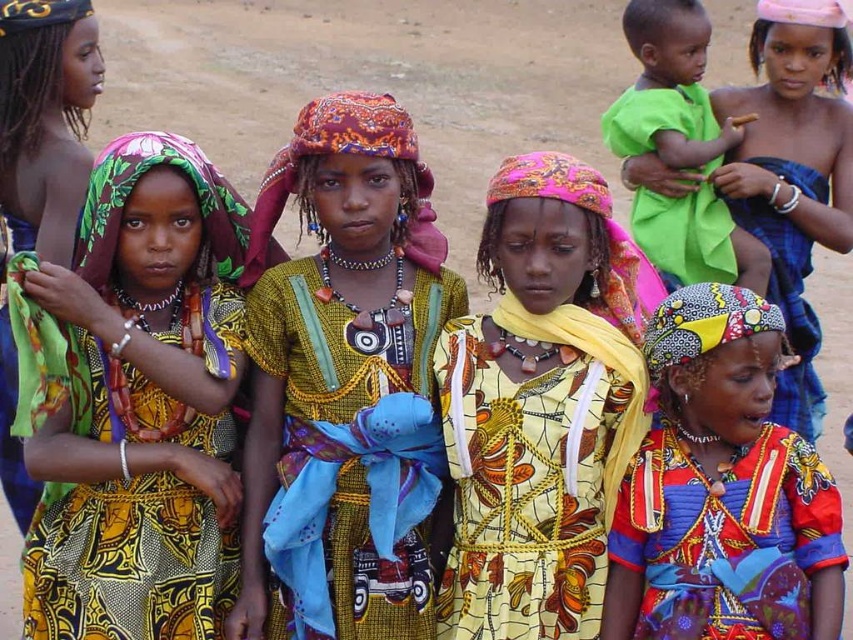
Can you confirm if printed fabric dress at left is positioned to the left of matte yellow dress at center?

Indeed, printed fabric dress at left is positioned on the left side of matte yellow dress at center.

Between printed fabric dress at left and matte yellow dress at center, which one appears on the left side from the viewer's perspective?

printed fabric dress at left

Is point (115, 204) in front of point (268, 515)?

That is True.

Where is `printed fabric dress at left`? The image size is (853, 640). printed fabric dress at left is located at coordinates (136, 403).

Is the position of printed fabric dress at left more distant than that of printed fabric dress at center?

No, printed fabric dress at left is in front of printed fabric dress at center.

Is printed fabric dress at left positioned before printed fabric dress at center?

Yes, it is.

The width and height of the screenshot is (853, 640). What do you see at coordinates (136, 403) in the screenshot? I see `printed fabric dress at left` at bounding box center [136, 403].

Locate an element on the screen. Image resolution: width=853 pixels, height=640 pixels. printed fabric dress at left is located at coordinates (136, 403).

Between yellow printed dress at center and vibrant printed dress at center, which one is positioned lower?

yellow printed dress at center is lower down.

Where is `yellow printed dress at center`? yellow printed dress at center is located at coordinates (541, 404).